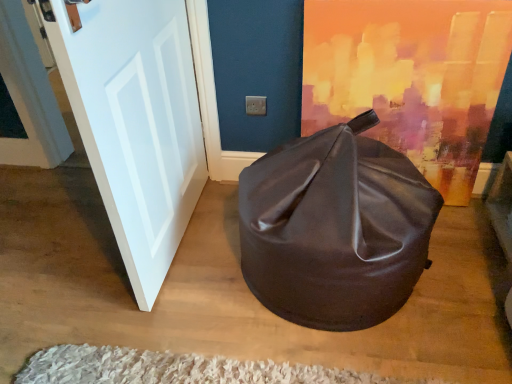
Question: Considering the positions of white shaggy rug at lower center and white glossy door at left in the image, is white shaggy rug at lower center wider or thinner than white glossy door at left?

Choices:
 (A) wide
 (B) thin

Answer: (A)

Question: Considering the positions of white shaggy rug at lower center and white glossy door at left in the image, is white shaggy rug at lower center bigger or smaller than white glossy door at left?

Choices:
 (A) small
 (B) big

Answer: (A)

Question: Estimate the real-world distances between objects in this image. Which object is farther from the white shaggy rug at lower center?

Choices:
 (A) white glossy door at left
 (B) shiny brown bean bag at center

Answer: (A)

Question: Estimate the real-world distances between objects in this image. Which object is closer to the white glossy door at left?

Choices:
 (A) white shaggy rug at lower center
 (B) shiny brown bean bag at center

Answer: (B)